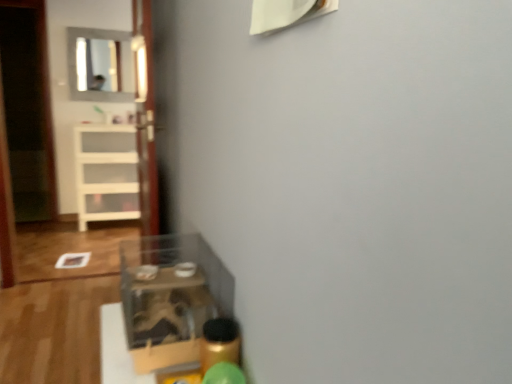
Image resolution: width=512 pixels, height=384 pixels. Identify the location of transparent glass door at center. (145, 116).

Locate an element on the screen. This screenshot has height=384, width=512. matte glass mirror at upper left is located at coordinates (100, 65).

At what (x,y) coordinates should I click in order to perform the action: click on transparent glass door at center. Please return your answer as a coordinate pair (x, y). The width and height of the screenshot is (512, 384). Looking at the image, I should click on (145, 116).

From the image's perspective, is transparent plastic shelf at lower left, the 1th shelf positioned from the front, located beneath matte glass mirror at upper left?

Correct, transparent plastic shelf at lower left, the 1th shelf positioned from the front, appears lower than matte glass mirror at upper left in the image.

Considering the relative sizes of transparent plastic shelf at lower left, the second shelf from the left, and matte glass mirror at upper left in the image provided, is transparent plastic shelf at lower left, the second shelf from the left, taller than matte glass mirror at upper left?

No, transparent plastic shelf at lower left, the second shelf from the left, is not taller than matte glass mirror at upper left.

Which is in front, point (181, 246) or point (96, 60)?

The point (181, 246) is closer to the camera.

Is matte glass mirror at upper left at the back of transparent plastic shelf at lower left, the 1th shelf positioned from the front?

No.

Between matte glass mirror at upper left and transparent glass door at center, which one appears on the left side from the viewer's perspective?

matte glass mirror at upper left is more to the left.

Which object is thinner, matte glass mirror at upper left or transparent glass door at center?

matte glass mirror at upper left is thinner.

From a real-world perspective, is matte glass mirror at upper left located beneath transparent glass door at center?

Actually, matte glass mirror at upper left is physically above transparent glass door at center in the real world.

Are matte glass mirror at upper left and transparent glass door at center beside each other?

No, matte glass mirror at upper left is not next to transparent glass door at center.

Is white glossy shelf at left, the second shelf when ordered from right to left, shorter than transparent glass door at center?

Correct, white glossy shelf at left, the second shelf when ordered from right to left, is not as tall as transparent glass door at center.

Looking at this image, considering the sizes of objects white glossy shelf at left, arranged as the second shelf when viewed from the front, and transparent glass door at center in the image provided, who is thinner, white glossy shelf at left, arranged as the second shelf when viewed from the front, or transparent glass door at center?

Thinner between the two is transparent glass door at center.

From a real-world perspective, is white glossy shelf at left, positioned as the first shelf in left-to-right order, over transparent glass door at center?

No, from a real-world perspective, white glossy shelf at left, positioned as the first shelf in left-to-right order, is not on top of transparent glass door at center.

Considering their positions, is white glossy shelf at left, arranged as the second shelf when viewed from the front, located in front of or behind transparent glass door at center?

Visually, white glossy shelf at left, arranged as the second shelf when viewed from the front, is located behind transparent glass door at center.

Which is more to the left, matte glass mirror at upper left or transparent plastic shelf at lower left, which is the first shelf in bottom-to-top order?

From the viewer's perspective, matte glass mirror at upper left appears more on the left side.

Which point is more distant from viewer, (95,81) or (213,278)?

The point (95,81) is farther from the camera.

From a real-world perspective, does matte glass mirror at upper left sit lower than transparent plastic shelf at lower left, the second shelf from the left?

No, from a real-world perspective, matte glass mirror at upper left is not under transparent plastic shelf at lower left, the second shelf from the left.

What's the angular difference between transparent plastic shelf at lower left, the second shelf from the back, and white glossy shelf at left, the second shelf when ordered from right to left,'s facing directions?

87.4 degrees.

Is transparent plastic shelf at lower left, the second shelf from the left, shorter than white glossy shelf at left, placed as the first shelf when sorted from back to front?

Correct, transparent plastic shelf at lower left, the second shelf from the left, is not as tall as white glossy shelf at left, placed as the first shelf when sorted from back to front.

Is transparent plastic shelf at lower left, the 1th shelf from the right, spatially inside white glossy shelf at left, placed as the first shelf when sorted from back to front, or outside of it?

transparent plastic shelf at lower left, the 1th shelf from the right, is spatially situated outside white glossy shelf at left, placed as the first shelf when sorted from back to front.

Can you confirm if transparent plastic shelf at lower left, the second shelf from the back, is bigger than white glossy shelf at left, the second shelf when ordered from right to left?

Incorrect, transparent plastic shelf at lower left, the second shelf from the back, is not larger than white glossy shelf at left, the second shelf when ordered from right to left.

From the image's perspective, is transparent glass door at center located beneath white glossy shelf at left, positioned as the first shelf in left-to-right order?

No, from the image's perspective, transparent glass door at center is not beneath white glossy shelf at left, positioned as the first shelf in left-to-right order.

This screenshot has height=384, width=512. There is a white glossy shelf at left, the second shelf when ordered from right to left. In order to click on glass door above it (from a real-world perspective) in this screenshot , I will do `click(145, 116)`.

Could you tell me if transparent glass door at center is facing white glossy shelf at left, arranged as the second shelf when viewed from the front?

No, transparent glass door at center is not aimed at white glossy shelf at left, arranged as the second shelf when viewed from the front.

Which object is wider, white glossy shelf at left, the second shelf when ordered from right to left, or transparent plastic shelf at lower left, the 1th shelf positioned from the front?

white glossy shelf at left, the second shelf when ordered from right to left.

Considering the relative positions of white glossy shelf at left, the 1th shelf positioned from the top, and transparent plastic shelf at lower left, the 2th shelf positioned from the top, in the image provided, is white glossy shelf at left, the 1th shelf positioned from the top, to the left of transparent plastic shelf at lower left, the 2th shelf positioned from the top, from the viewer's perspective?

Correct, you'll find white glossy shelf at left, the 1th shelf positioned from the top, to the left of transparent plastic shelf at lower left, the 2th shelf positioned from the top.

From a real-world perspective, relative to transparent plastic shelf at lower left, the 2th shelf positioned from the top, is white glossy shelf at left, arranged as the second shelf when viewed from the front, vertically above or below?

Clearly, from a real-world perspective, white glossy shelf at left, arranged as the second shelf when viewed from the front, is below transparent plastic shelf at lower left, the 2th shelf positioned from the top.

Find the location of a particular element. The image size is (512, 384). mirror that appears behind the transparent plastic shelf at lower left, which is the first shelf in bottom-to-top order is located at coordinates (100, 65).

Image resolution: width=512 pixels, height=384 pixels. In the image, there is a matte glass mirror at upper left. Find the location of `glass door below it (from a real-world perspective)`. glass door below it (from a real-world perspective) is located at coordinates tap(145, 116).

Looking at the image, which one is located closer to transparent plastic shelf at lower left, the 1th shelf from the right, white glossy shelf at left, placed as the first shelf when sorted from back to front, or transparent glass door at center?

Among the two, transparent glass door at center is located nearer to transparent plastic shelf at lower left, the 1th shelf from the right.

When comparing their distances from transparent glass door at center, does matte glass mirror at upper left or transparent plastic shelf at lower left, the second shelf from the left, seem further?

matte glass mirror at upper left lies further to transparent glass door at center than the other object.

Looking at the image, which one is located closer to transparent glass door at center, white glossy shelf at left, arranged as the second shelf when viewed from the front, or transparent plastic shelf at lower left, the 1th shelf positioned from the front?

Based on the image, transparent plastic shelf at lower left, the 1th shelf positioned from the front, appears to be nearer to transparent glass door at center.

From the image, which object appears to be farther from transparent plastic shelf at lower left, the 2th shelf positioned from the top, white glossy shelf at left, arranged as the second shelf when viewed from the front, or matte glass mirror at upper left?

Based on the image, matte glass mirror at upper left appears to be further to transparent plastic shelf at lower left, the 2th shelf positioned from the top.

From the image, which object appears to be farther from transparent plastic shelf at lower left, the second shelf from the left, transparent glass door at center or matte glass mirror at upper left?

matte glass mirror at upper left lies further to transparent plastic shelf at lower left, the second shelf from the left, than the other object.

Looking at the image, which one is located further to white glossy shelf at left, positioned as the first shelf in left-to-right order, matte glass mirror at upper left or transparent glass door at center?

The object further to white glossy shelf at left, positioned as the first shelf in left-to-right order, is transparent glass door at center.

Which object lies nearer to the anchor point white glossy shelf at left, the second shelf when ordered from right to left, transparent glass door at center or matte glass mirror at upper left?

Based on the image, matte glass mirror at upper left appears to be nearer to white glossy shelf at left, the second shelf when ordered from right to left.

When comparing their distances from white glossy shelf at left, placed as the first shelf when sorted from back to front, does transparent plastic shelf at lower left, the second shelf from the left, or matte glass mirror at upper left seem closer?

Among the two, matte glass mirror at upper left is located nearer to white glossy shelf at left, placed as the first shelf when sorted from back to front.

Image resolution: width=512 pixels, height=384 pixels. I want to click on shelf positioned between transparent plastic shelf at lower left, the second shelf from the left, and matte glass mirror at upper left from near to far, so click(x=106, y=173).

Identify the location of shelf between transparent glass door at center and matte glass mirror at upper left from front to back. (106, 173).

Image resolution: width=512 pixels, height=384 pixels. What are the coordinates of `glass door positioned between transparent plastic shelf at lower left, the 2th shelf positioned from the top, and matte glass mirror at upper left from near to far` in the screenshot? It's located at (145, 116).

This screenshot has width=512, height=384. I want to click on glass door located between transparent plastic shelf at lower left, the 1th shelf from the right, and white glossy shelf at left, arranged as the second shelf when viewed from the front, in the depth direction, so click(145, 116).